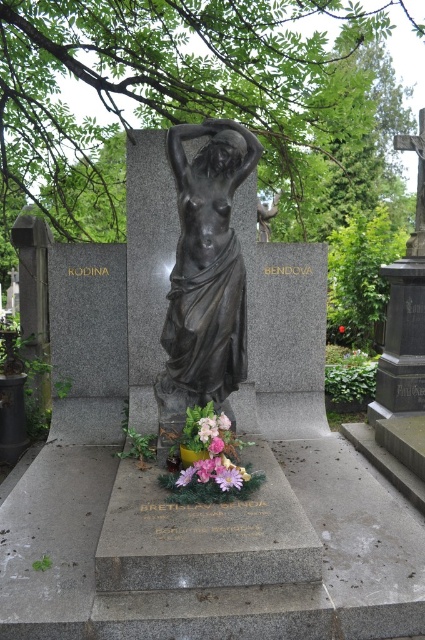
Question: Can you confirm if purple matte flower at center is bigger than pink matte flower at center?

Choices:
 (A) no
 (B) yes

Answer: (B)

Question: Which point is closer to the camera?

Choices:
 (A) (231, 483)
 (B) (218, 260)
 (C) (340, 326)
 (D) (197, 420)

Answer: (A)

Question: Does pink floral bouquet at center appear under pink matte flower at center?

Choices:
 (A) no
 (B) yes

Answer: (B)

Question: Among these points, which one is nearest to the camera?

Choices:
 (A) (176, 321)
 (B) (237, 488)

Answer: (B)

Question: Which of the following is the farthest from the observer?

Choices:
 (A) pink matte flower at center
 (B) bronze statue at center

Answer: (A)

Question: Is the position of purple matte flower at center more distant than that of pink matte flower at center?

Choices:
 (A) yes
 (B) no

Answer: (B)